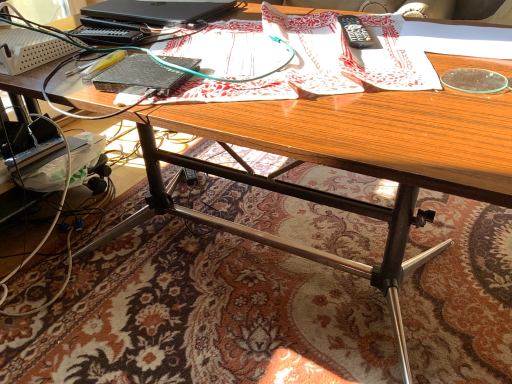
The width and height of the screenshot is (512, 384). In order to click on vacant area that lies between black matte laptop at upper left and black plastic remote control at upper right in this screenshot , I will do `click(272, 28)`.